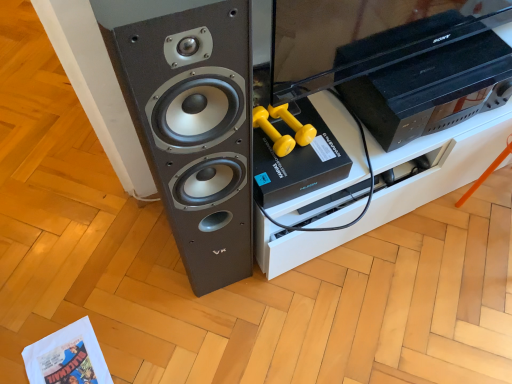
Locate an element on the screen. vacant area in front of black plastic tv stand at center is located at coordinates (390, 294).